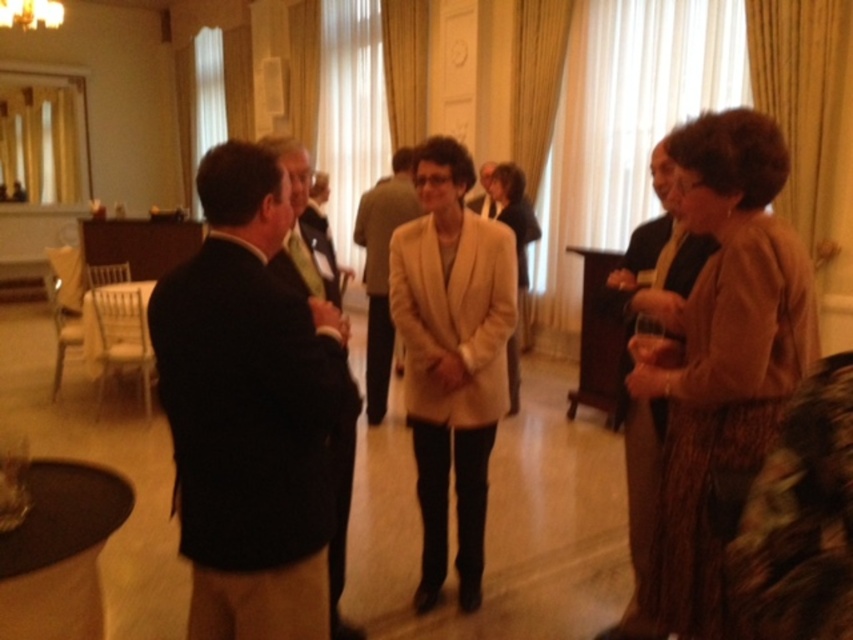
Can you confirm if matte brown suit at right is positioned below beige fabric coat at center?

Indeed, matte brown suit at right is positioned under beige fabric coat at center.

The image size is (853, 640). What do you see at coordinates (660, 260) in the screenshot?
I see `matte brown suit at right` at bounding box center [660, 260].

Locate an element on the screen. The height and width of the screenshot is (640, 853). matte brown suit at right is located at coordinates pos(660,260).

Which is below, beige woolen blazer at center or matte black suit at center?

beige woolen blazer at center is below.

Does point (474, 305) lie in front of point (482, 189)?

Yes, it is.

Where is `beige woolen blazer at center`? The width and height of the screenshot is (853, 640). beige woolen blazer at center is located at coordinates coord(463,371).

Does matte brown suit at right have a smaller size compared to dark suit jacket at center?

Incorrect, matte brown suit at right is not smaller in size than dark suit jacket at center.

The image size is (853, 640). What do you see at coordinates (660, 260) in the screenshot? I see `matte brown suit at right` at bounding box center [660, 260].

Is point (643, 420) farther from camera compared to point (345, 499)?

No.

Identify the location of matte brown suit at right. This screenshot has width=853, height=640. (660, 260).